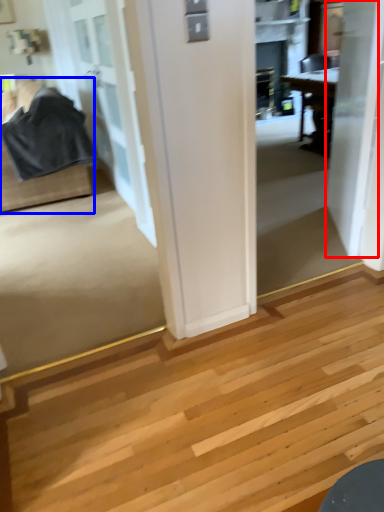
Question: Among these objects, which one is farthest to the camera, door (highlighted by a red box) or furniture (highlighted by a blue box)?

Choices:
 (A) door
 (B) furniture

Answer: (B)